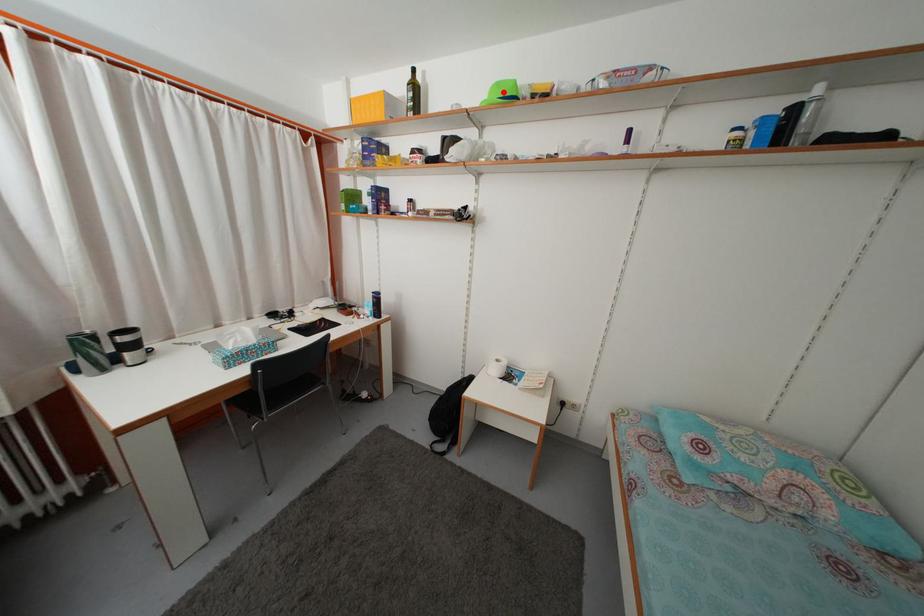
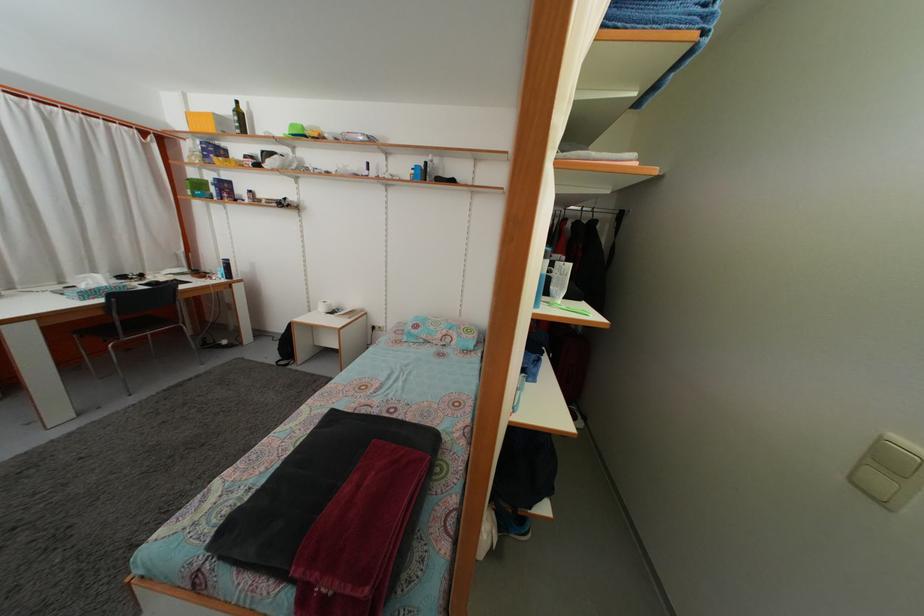
Question: I am providing you with two images of the same scene from different viewpoints. A red point is marked on the first image. Is the red point's position out of view in image 2?

Choices:
 (A) Yes
 (B) No

Answer: (B)